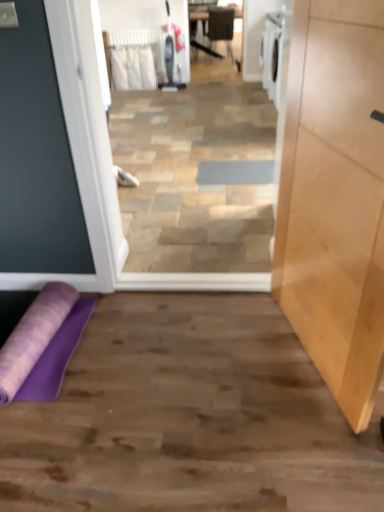
Find the location of a particular element. Image resolution: width=384 pixels, height=512 pixels. vacant space positioned to the left of light wood cabinet at right is located at coordinates [x=202, y=364].